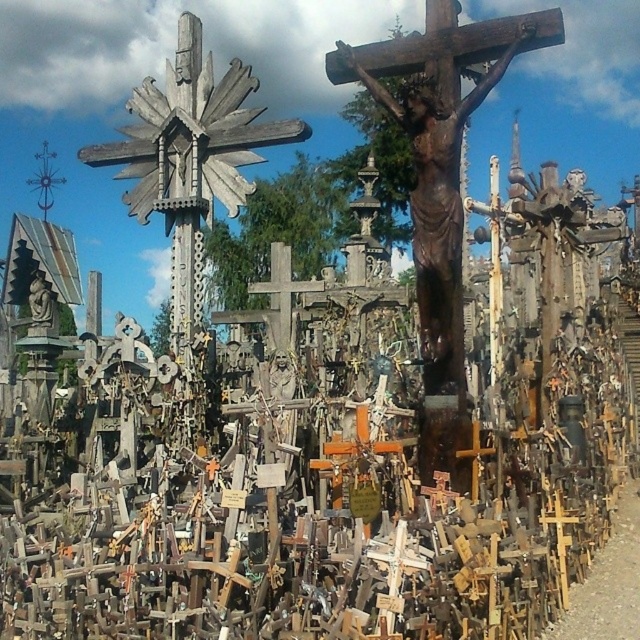
In the scene shown: You are standing in front of the memorial site and want to place a new plaque on one of the crosses. If you choose the wooden crucifix at center and the wooden cross at upper left, which one will require you to climb a ladder to reach its top?

The wooden cross at upper left requires a ladder because it is further away from the viewer than the wooden crucifix at center, so it is taller and harder to reach.